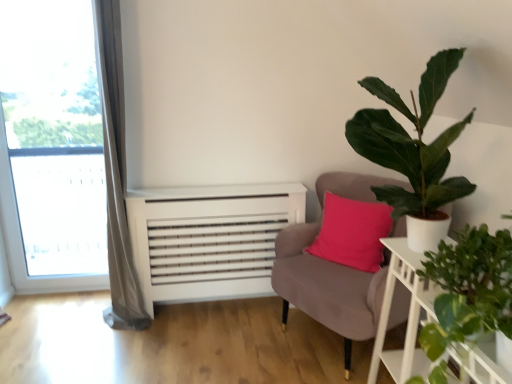
Where is `green leafy plant at right, arranged as the 1th houseplant when ordered from the bottom`? The width and height of the screenshot is (512, 384). green leafy plant at right, arranged as the 1th houseplant when ordered from the bottom is located at coordinates (469, 288).

Identify the location of velvet pink chair at center. The height and width of the screenshot is (384, 512). (327, 287).

What is the approximate height of green matte plant at upper right, which appears as the 2th houseplant when ordered from the bottom?

It is 32.33 inches.

This screenshot has width=512, height=384. Describe the element at coordinates (52, 147) in the screenshot. I see `transparent glass window at left` at that location.

Identify the location of green leafy plant at right, positioned as the 2th houseplant in top-to-bottom order. (469, 288).

Based on the photo, is transparent glass window at left in contact with white wooden table at right?

There is a gap between transparent glass window at left and white wooden table at right.

Is transparent glass window at left oriented towards white wooden table at right?

No, transparent glass window at left is not turned towards white wooden table at right.

Looking at this image, is transparent glass window at left smaller than white wooden table at right?

No, transparent glass window at left is not smaller than white wooden table at right.

From a real-world perspective, is velvet pink chair at center above or below green leafy plant at right, positioned as the 2th houseplant in top-to-bottom order?

From a real-world perspective, velvet pink chair at center is physically below green leafy plant at right, positioned as the 2th houseplant in top-to-bottom order.

Is velvet pink chair at center inside or outside of green leafy plant at right, positioned as the 2th houseplant in top-to-bottom order?

velvet pink chair at center cannot be found inside green leafy plant at right, positioned as the 2th houseplant in top-to-bottom order.

Which is in front, velvet pink chair at center or green leafy plant at right, positioned as the 2th houseplant in top-to-bottom order?

Positioned in front is green leafy plant at right, positioned as the 2th houseplant in top-to-bottom order.

Do you think transparent glass window at left is within green matte plant at upper right, which appears as the 2th houseplant when ordered from the bottom, or outside of it?

transparent glass window at left lies outside green matte plant at upper right, which appears as the 2th houseplant when ordered from the bottom.

Is the depth of transparent glass window at left greater than that of green matte plant at upper right, which appears as the 1th houseplant when viewed from the top?

Yes, it is.

From the image's perspective, which is below, transparent glass window at left or green matte plant at upper right, which appears as the 1th houseplant when viewed from the top?

green matte plant at upper right, which appears as the 1th houseplant when viewed from the top, from the image's perspective.

Considering the sizes of objects white wooden table at right and velvet pink chair at center in the image provided, who is wider, white wooden table at right or velvet pink chair at center?

Wider between the two is velvet pink chair at center.

From a real-world perspective, who is located higher, white wooden table at right or velvet pink chair at center?

velvet pink chair at center, from a real-world perspective.

In the scene shown: Can you see white wooden table at right touching velvet pink chair at center?

They are not placed beside each other.

Considering their positions, is white wooden table at right located in front of or behind velvet pink chair at center?

Visually, white wooden table at right is located in front of velvet pink chair at center.

From their relative heights in the image, would you say green leafy plant at right, positioned as the 2th houseplant in top-to-bottom order, is taller or shorter than white wooden table at right?

Considering their sizes, green leafy plant at right, positioned as the 2th houseplant in top-to-bottom order, has less height than white wooden table at right.

Is green leafy plant at right, positioned as the 2th houseplant in top-to-bottom order, directly adjacent to white wooden table at right?

No, green leafy plant at right, positioned as the 2th houseplant in top-to-bottom order, is not touching white wooden table at right.

Which is closer, (436,298) or (383,313)?

Point (436,298).

From a real-world perspective, who is located higher, green leafy plant at right, positioned as the 2th houseplant in top-to-bottom order, or white wooden table at right?

From a 3D spatial view, green leafy plant at right, positioned as the 2th houseplant in top-to-bottom order, is above.

Between green matte plant at upper right, which appears as the 2th houseplant when ordered from the bottom, and green leafy plant at right, arranged as the 1th houseplant when ordered from the bottom, which one has smaller size?

Smaller between the two is green leafy plant at right, arranged as the 1th houseplant when ordered from the bottom.

Does green matte plant at upper right, which appears as the 2th houseplant when ordered from the bottom, come behind green leafy plant at right, positioned as the 2th houseplant in top-to-bottom order?

No, green matte plant at upper right, which appears as the 2th houseplant when ordered from the bottom, is closer to the camera.

From a real-world perspective, which is physically above, green leafy plant at right, arranged as the 1th houseplant when ordered from the bottom, or velvet pink chair at center?

green leafy plant at right, arranged as the 1th houseplant when ordered from the bottom, from a real-world perspective.

Is green leafy plant at right, positioned as the 2th houseplant in top-to-bottom order, taller than velvet pink chair at center?

Incorrect, the height of green leafy plant at right, positioned as the 2th houseplant in top-to-bottom order, is not larger of that of velvet pink chair at center.

Is green leafy plant at right, positioned as the 2th houseplant in top-to-bottom order, touching velvet pink chair at center?

green leafy plant at right, positioned as the 2th houseplant in top-to-bottom order, and velvet pink chair at center are clearly separated.

Is green leafy plant at right, positioned as the 2th houseplant in top-to-bottom order, outside of velvet pink chair at center?

Yes, green leafy plant at right, positioned as the 2th houseplant in top-to-bottom order, is outside of velvet pink chair at center.

Locate an element on the screen. Image resolution: width=512 pixels, height=384 pixels. window above the white wooden table at right (from the image's perspective) is located at coordinates (52, 147).

Image resolution: width=512 pixels, height=384 pixels. Find the location of `chair below the green leafy plant at right, arranged as the 1th houseplant when ordered from the bottom (from the image's perspective)`. chair below the green leafy plant at right, arranged as the 1th houseplant when ordered from the bottom (from the image's perspective) is located at coordinates (327, 287).

Considering their positions, is white wooden table at right positioned closer to velvet pink chair at center than green leafy plant at right, positioned as the 2th houseplant in top-to-bottom order?

white wooden table at right is closer to velvet pink chair at center.

Estimate the real-world distances between objects in this image. Which object is closer to white wooden table at right, transparent glass window at left or velvet pink chair at center?

velvet pink chair at center is closer to white wooden table at right.

From the image, which object appears to be nearer to transparent glass window at left, green leafy plant at right, positioned as the 2th houseplant in top-to-bottom order, or velvet pink chair at center?

velvet pink chair at center is closer to transparent glass window at left.

From the image, which object appears to be farther from white wooden table at right, green matte plant at upper right, which appears as the 2th houseplant when ordered from the bottom, or transparent glass window at left?

The object further to white wooden table at right is transparent glass window at left.

From the image, which object appears to be farther from green leafy plant at right, arranged as the 1th houseplant when ordered from the bottom, white wooden table at right or velvet pink chair at center?

Among the two, velvet pink chair at center is located further to green leafy plant at right, arranged as the 1th houseplant when ordered from the bottom.

Estimate the real-world distances between objects in this image. Which object is closer to velvet pink chair at center, green matte plant at upper right, which appears as the 2th houseplant when ordered from the bottom, or white wooden table at right?

Based on the image, white wooden table at right appears to be nearer to velvet pink chair at center.

Which object lies further to the anchor point transparent glass window at left, velvet pink chair at center or white wooden table at right?

white wooden table at right is positioned further to the anchor transparent glass window at left.

From the image, which object appears to be nearer to green matte plant at upper right, which appears as the 1th houseplant when viewed from the top, white wooden table at right or transparent glass window at left?

white wooden table at right is closer to green matte plant at upper right, which appears as the 1th houseplant when viewed from the top.

Where is `chair between transparent glass window at left and white wooden table at right`? The height and width of the screenshot is (384, 512). chair between transparent glass window at left and white wooden table at right is located at coordinates (327, 287).

Identify the location of table between transparent glass window at left and green leafy plant at right, arranged as the 1th houseplant when ordered from the bottom, in the horizontal direction. point(390,306).

The width and height of the screenshot is (512, 384). Find the location of `table located between green leafy plant at right, arranged as the 1th houseplant when ordered from the bottom, and velvet pink chair at center in the depth direction`. table located between green leafy plant at right, arranged as the 1th houseplant when ordered from the bottom, and velvet pink chair at center in the depth direction is located at coordinates (390, 306).

Find the location of a particular element. This screenshot has height=384, width=512. chair between transparent glass window at left and green matte plant at upper right, which appears as the 2th houseplant when ordered from the bottom, from left to right is located at coordinates (327, 287).